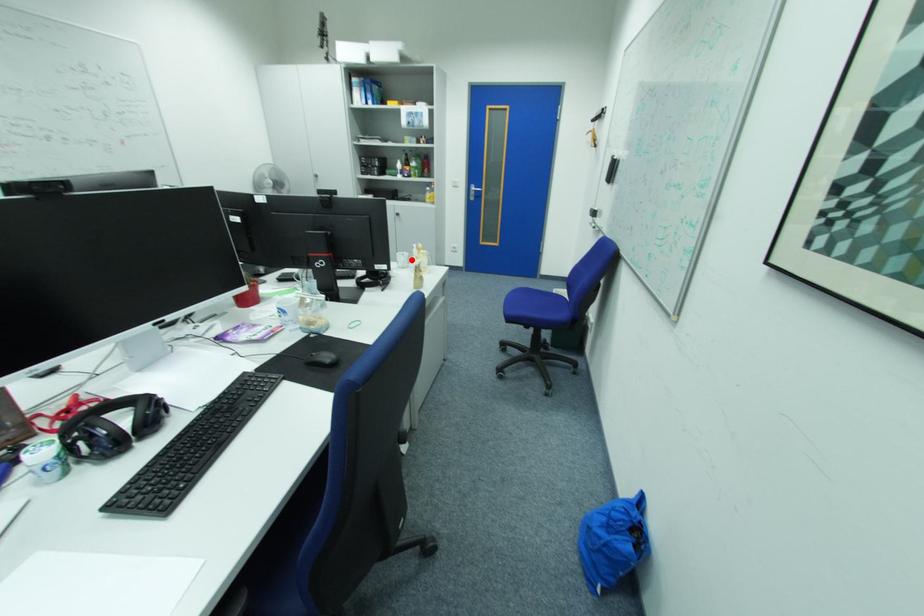
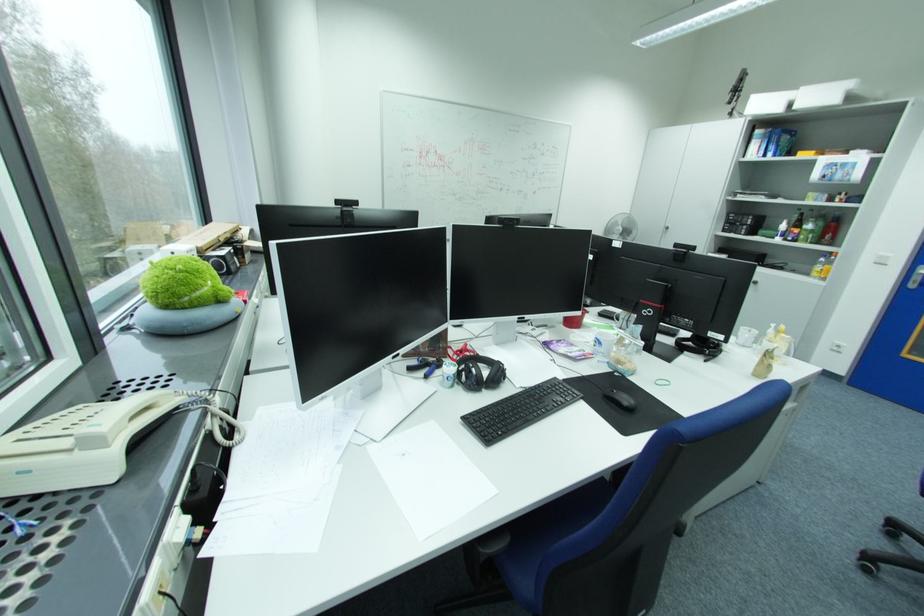
In the second image, find the point that corresponds to the highlighted location in the first image.

(756, 336)